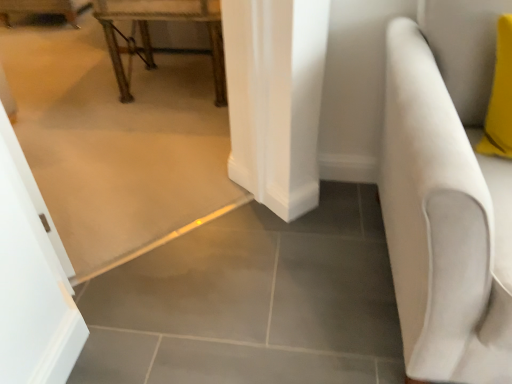
Question: Relative to metallic gold table at upper left, is white fabric armchair at right in front or behind?

Choices:
 (A) front
 (B) behind

Answer: (A)

Question: Is white fabric armchair at right bigger or smaller than metallic gold table at upper left?

Choices:
 (A) big
 (B) small

Answer: (A)

Question: In the image, is white fabric armchair at right on the left side or the right side of metallic gold table at upper left?

Choices:
 (A) left
 (B) right

Answer: (B)

Question: From a real-world perspective, relative to white fabric armchair at right, is metallic gold table at upper left vertically above or below?

Choices:
 (A) above
 (B) below

Answer: (B)

Question: Is metallic gold table at upper left in front of or behind white fabric armchair at right in the image?

Choices:
 (A) front
 (B) behind

Answer: (B)

Question: Is metallic gold table at upper left taller or shorter than white fabric armchair at right?

Choices:
 (A) short
 (B) tall

Answer: (A)

Question: From the image's perspective, is metallic gold table at upper left positioned above or below white fabric armchair at right?

Choices:
 (A) above
 (B) below

Answer: (A)